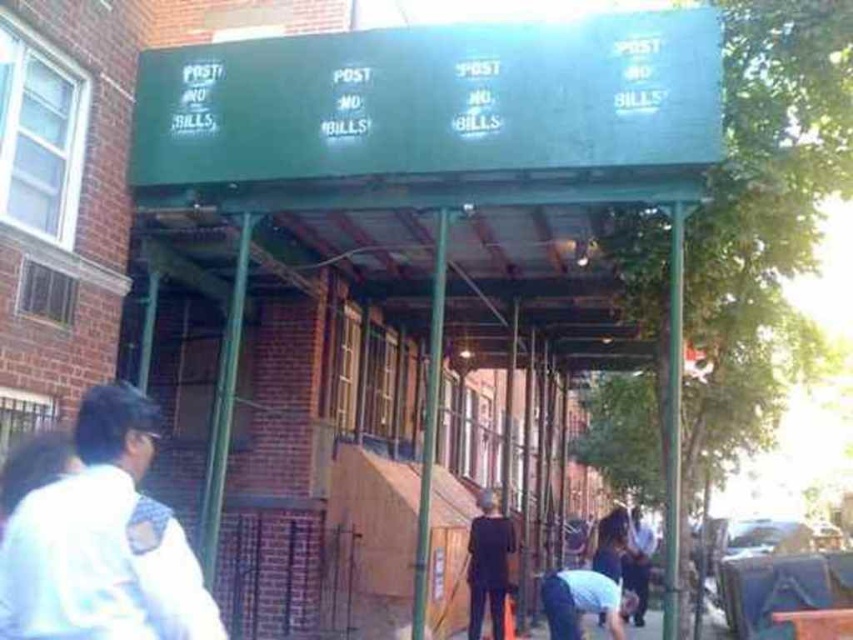
Does point (120, 448) lie behind point (618, 596)?

No, (120, 448) is in front of (618, 596).

Which of these two, white fabric backpack at left or light blue fabric at lower center, stands taller?

white fabric backpack at left

Does point (78, 528) come behind point (585, 596)?

That is False.

Identify the location of white fabric backpack at left. Image resolution: width=853 pixels, height=640 pixels. (103, 541).

Does white fabric backpack at left have a lesser width compared to black matte suit at center?

No, white fabric backpack at left is not thinner than black matte suit at center.

Between white fabric backpack at left and black matte suit at center, which one is positioned higher?

white fabric backpack at left is higher up.

Is point (78, 474) closer to viewer compared to point (479, 620)?

Yes, it is.

Where is `white fabric backpack at left`? white fabric backpack at left is located at coordinates (103, 541).

Can you confirm if black matte suit at center is smaller than light blue fabric at lower center?

Actually, black matte suit at center might be larger than light blue fabric at lower center.

Describe the element at coordinates (488, 564) in the screenshot. This screenshot has width=853, height=640. I see `black matte suit at center` at that location.

Find the location of a particular element. Image resolution: width=853 pixels, height=640 pixels. black matte suit at center is located at coordinates (488, 564).